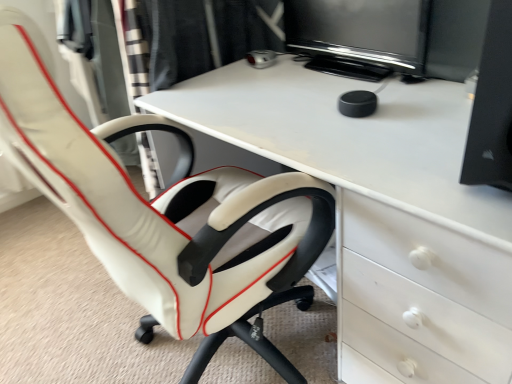
Where is `vacant position to the left of black glossy monitor at upper center`? vacant position to the left of black glossy monitor at upper center is located at coordinates (267, 84).